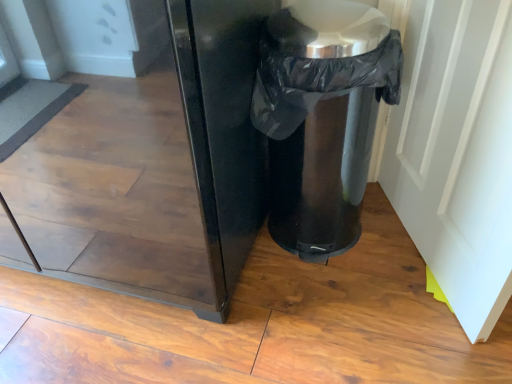
Question: From a real-world perspective, is black plastic trash can at lower right located beneath white glossy door at right?

Choices:
 (A) yes
 (B) no

Answer: (A)

Question: From the image's perspective, is black plastic trash can at lower right on white glossy door at right?

Choices:
 (A) no
 (B) yes

Answer: (B)

Question: Is black plastic trash can at lower right positioned with its back to white glossy door at right?

Choices:
 (A) yes
 (B) no

Answer: (B)

Question: Can you confirm if black plastic trash can at lower right is wider than white glossy door at right?

Choices:
 (A) yes
 (B) no

Answer: (A)

Question: Is black plastic trash can at lower right smaller than white glossy door at right?

Choices:
 (A) no
 (B) yes

Answer: (A)

Question: Is the surface of black plastic trash can at lower right in direct contact with white glossy door at right?

Choices:
 (A) yes
 (B) no

Answer: (B)

Question: Is white glossy door at right positioned with its back to black plastic trash can at lower right?

Choices:
 (A) yes
 (B) no

Answer: (A)

Question: Can you confirm if white glossy door at right is positioned to the left of black plastic trash can at lower right?

Choices:
 (A) no
 (B) yes

Answer: (A)

Question: From a real-world perspective, is white glossy door at right located higher than black plastic trash can at lower right?

Choices:
 (A) yes
 (B) no

Answer: (A)

Question: Is white glossy door at right to the right of black plastic trash can at lower right from the viewer's perspective?

Choices:
 (A) no
 (B) yes

Answer: (B)

Question: Could black plastic trash can at lower right be considered to be inside white glossy door at right?

Choices:
 (A) no
 (B) yes

Answer: (A)

Question: Can you confirm if white glossy door at right is wider than black plastic trash can at lower right?

Choices:
 (A) yes
 (B) no

Answer: (B)

Question: Considering the positions of white glossy door at right and black plastic trash can at lower right in the image, is white glossy door at right wider or thinner than black plastic trash can at lower right?

Choices:
 (A) wide
 (B) thin

Answer: (B)